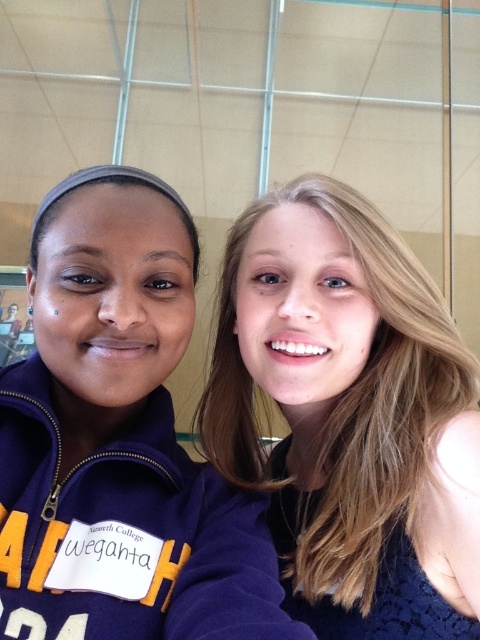
Based on the scene description, where is the blonde hair at upper right located in the image?

The blonde hair at upper right is located at point (349, 417) in the image.

From the picture: You are a photographer setting up for a group photo. You need to ensure that the blonde hair at upper right and the matte purple sweatshirt at center are at least 6 inches apart to avoid blurring. Based on the scene description, will this requirement be met?

The distance between the blonde hair at upper right and the matte purple sweatshirt at center is 6.64 inches, which exceeds the minimum requirement of 6 inches. Therefore, the requirement is met.

You are a photographer trying to capture a closeup of the blonde hair at upper right and the matte purple sweatshirt at center. Given their sizes in the frame, which one should you zoom in on first to ensure both are in focus?

The blonde hair at upper right is larger in size than the matte purple sweatshirt at center, so you should zoom in on the blonde hair at upper right first to ensure both are in focus.